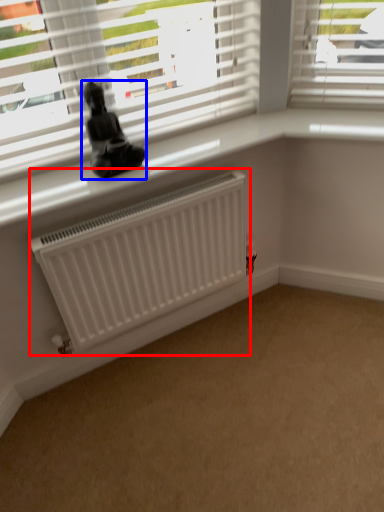
Question: Among these objects, which one is farthest to the camera, radiator (highlighted by a red box) or miniature (highlighted by a blue box)?

Choices:
 (A) radiator
 (B) miniature

Answer: (A)